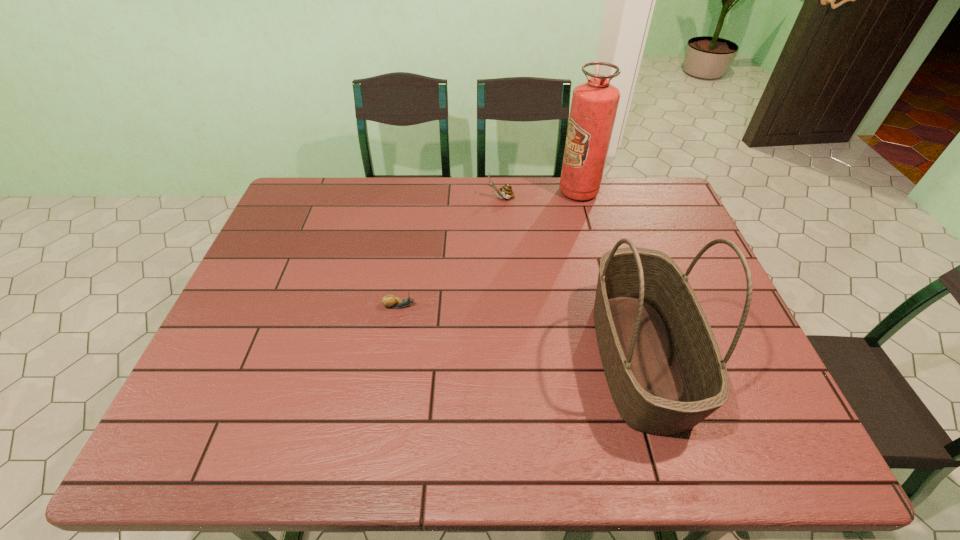
Image resolution: width=960 pixels, height=540 pixels. I want to click on free location located on the face of the second object from left to right, so click(472, 198).

This screenshot has width=960, height=540. I want to click on vacant space located 0.210m on the face of the second object from left to right, so click(425, 198).

At what (x,y) coordinates should I click in order to perform the action: click on free space located on the face of the second object from left to right. Please return your answer as a coordinate pair (x, y). Looking at the image, I should click on tap(446, 198).

Identify the location of blank space located on the front-facing side of the leftmost object. The image size is (960, 540). (561, 306).

Find the location of `fire extinguisher that is at the far edge`. fire extinguisher that is at the far edge is located at coordinates (594, 105).

At what (x,y) coordinates should I click in order to perform the action: click on snail situated at the far edge. Please return your answer as a coordinate pair (x, y). Looking at the image, I should click on coord(505,191).

You are a GUI agent. You are given a task and a screenshot of the screen. Output one action in this format:
    pyautogui.click(x=<x>, y=<y>)
    Task: Click on the object situated at the near edge
    The width and height of the screenshot is (960, 540).
    Given the screenshot: What is the action you would take?
    pyautogui.click(x=662, y=363)

At what (x,y) coordinates should I click in order to perform the action: click on object that is at the right edge. Please return your answer as a coordinate pair (x, y). Looking at the image, I should click on (662, 363).

At what (x,y) coordinates should I click in order to perform the action: click on object located in the near right corner section of the desktop. Please return your answer as a coordinate pair (x, y). The width and height of the screenshot is (960, 540). Looking at the image, I should click on (662, 363).

The height and width of the screenshot is (540, 960). In the image, there is a desktop. Identify the location of vacant area at the far edge. (453, 185).